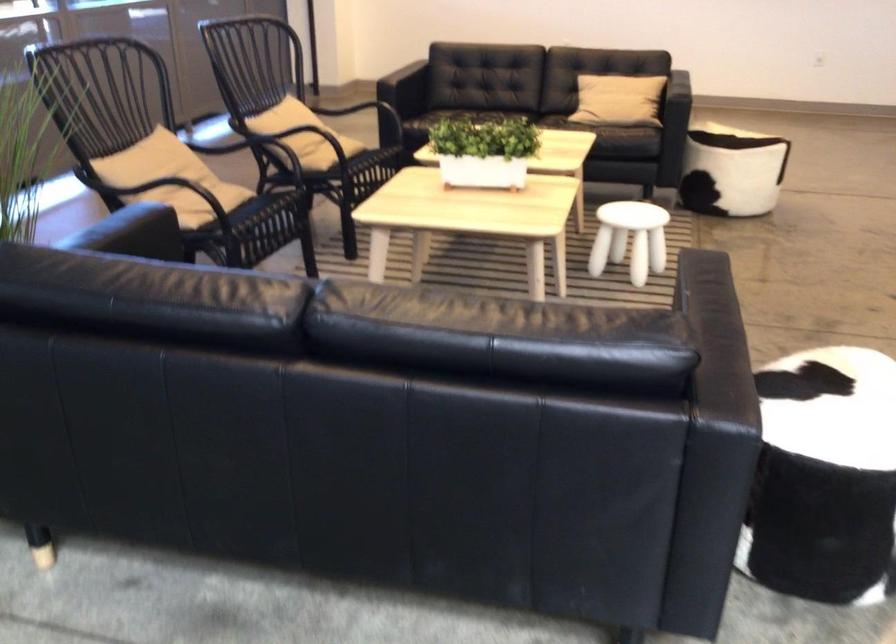
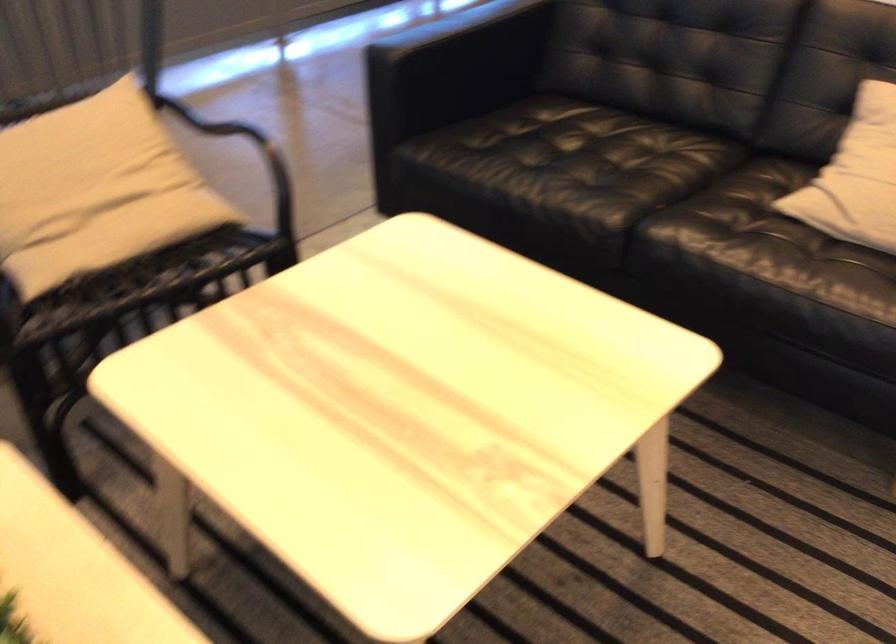
Question: In a continuous first-person perspective shot, in which direction is the camera moving?

Choices:
 (A) Left
 (B) Right
 (C) Forward
 (D) Backward

Answer: (C)